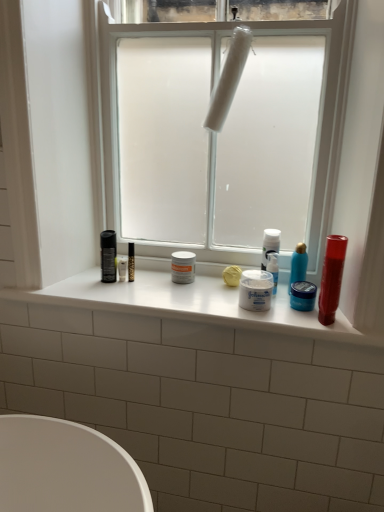
Image resolution: width=384 pixels, height=512 pixels. Describe the element at coordinates (255, 290) in the screenshot. I see `white matte jar at center, which appears as the 2th toiletry when viewed from the left` at that location.

From the picture: How much space does blue glossy bottle at center right, which ranks as the fourth toiletry in left-to-right order, occupy horizontally?

2.44 inches.

How much space does blue glossy bottle at center right, the first toiletry positioned from the right, occupy vertically?

6.68 inches.

What do you see at coordinates (183, 267) in the screenshot?
I see `white matte jar at center, positioned as the first toiletry in left-to-right order` at bounding box center [183, 267].

From the picture: What is the approximate height of blue matte jar at center, which is the third toiletry in left-to-right order?

blue matte jar at center, which is the third toiletry in left-to-right order, is 3.15 inches in height.

Describe the element at coordinates (331, 278) in the screenshot. This screenshot has width=384, height=512. I see `shiny red tube at right` at that location.

This screenshot has width=384, height=512. I want to click on shiny red tube at right, so click(x=331, y=278).

What are the coordinates of `white frosted glass window at center` in the screenshot? It's located at (77, 169).

Is white matte plastic at center in front of white frosted glass window at center?

No.

Is white matte plastic at center wider or thinner than white frosted glass window at center?

Result: In the image, white matte plastic at center appears to be wider than white frosted glass window at center.

From a real-world perspective, is white matte plastic at center located higher than white frosted glass window at center?

Correct, in the physical world, white matte plastic at center is higher than white frosted glass window at center.

From the image's perspective, relative to white frosted glass window at center, is white matte plastic at center above or below?

Based on their image positions, white matte plastic at center is located above white frosted glass window at center.

Between white matte jar at center, placed as the 4th toiletry when sorted from right to left, and blue matte jar at center, the second toiletry when ordered from right to left, which one has smaller width?

blue matte jar at center, the second toiletry when ordered from right to left.

Considering the relative positions of white matte jar at center, placed as the 4th toiletry when sorted from right to left, and blue matte jar at center, which is the third toiletry in left-to-right order, in the image provided, is white matte jar at center, placed as the 4th toiletry when sorted from right to left, in front of blue matte jar at center, which is the third toiletry in left-to-right order,?

No, it is behind blue matte jar at center, which is the third toiletry in left-to-right order.

From a real-world perspective, is white matte jar at center, placed as the 4th toiletry when sorted from right to left, physically below blue matte jar at center, which is the third toiletry in left-to-right order?

No, from a real-world perspective, white matte jar at center, placed as the 4th toiletry when sorted from right to left, is not below blue matte jar at center, which is the third toiletry in left-to-right order.

Considering the points (329, 287) and (279, 310), which point is in front, point (329, 287) or point (279, 310)?

Positioned in front is point (329, 287).

Where is `window sill located below the shiny red tube at right (from the image's perspective)`? window sill located below the shiny red tube at right (from the image's perspective) is located at coordinates (192, 302).

In terms of height, does shiny red tube at right look taller or shorter compared to white glossy window sill at center?

In the image, shiny red tube at right appears to be taller than white glossy window sill at center.

Is shiny red tube at right looking in the opposite direction of white glossy window sill at center?

No.

Who is bigger, white frosted glass window at center or white glossy window sill at center?

Bigger between the two is white frosted glass window at center.

Which is in front, point (380, 144) or point (120, 288)?

Positioned in front is point (380, 144).

From the image's perspective, is white frosted glass window at center under white glossy window sill at center?

Actually, white frosted glass window at center appears above white glossy window sill at center in the image.

From a real-world perspective, who is located lower, white frosted glass window at center or white glossy window sill at center?

In real-world perspective, white glossy window sill at center is lower.

This screenshot has width=384, height=512. In order to click on window screen that is above the white matte jar at center, placed as the 4th toiletry when sorted from right to left (from the image's perspective) in this screenshot , I will do `click(270, 143)`.

Does white matte jar at center, positioned as the first toiletry in left-to-right order, have a lesser height compared to white matte plastic at center?

Correct, white matte jar at center, positioned as the first toiletry in left-to-right order, is not as tall as white matte plastic at center.

Is white matte jar at center, positioned as the first toiletry in left-to-right order, completely or partially outside of white matte plastic at center?

That's correct, white matte jar at center, positioned as the first toiletry in left-to-right order, is outside of white matte plastic at center.

Is white matte jar at center, placed as the 4th toiletry when sorted from right to left, oriented towards white matte plastic at center?

No, white matte jar at center, placed as the 4th toiletry when sorted from right to left, does not turn towards white matte plastic at center.

Considering the relative sizes of white matte jar at center, which appears as the 2th toiletry when viewed from the left, and blue glossy bottle at center right, which ranks as the fourth toiletry in left-to-right order, in the image provided, is white matte jar at center, which appears as the 2th toiletry when viewed from the left, shorter than blue glossy bottle at center right, which ranks as the fourth toiletry in left-to-right order,?

Yes.

Is point (269, 303) closer or farther from the camera than point (304, 248)?

Point (269, 303).

Which is more to the right, white matte jar at center, which appears as the 2th toiletry when viewed from the left, or blue glossy bottle at center right, which ranks as the fourth toiletry in left-to-right order?

From the viewer's perspective, blue glossy bottle at center right, which ranks as the fourth toiletry in left-to-right order, appears more on the right side.

Does white matte jar at center, the third toiletry positioned from the right, have a lesser width compared to blue glossy bottle at center right, which ranks as the fourth toiletry in left-to-right order?

In fact, white matte jar at center, the third toiletry positioned from the right, might be wider than blue glossy bottle at center right, which ranks as the fourth toiletry in left-to-right order.

Who is bigger, white matte plastic at center or shiny red tube at right?

Bigger between the two is white matte plastic at center.

Does point (224, 226) come behind point (326, 279)?

Yes, point (224, 226) is behind point (326, 279).

Which object is positioned more to the left, white matte plastic at center or shiny red tube at right?

white matte plastic at center is more to the left.

Is white matte plastic at center positioned far away from shiny red tube at right?

white matte plastic at center is actually quite close to shiny red tube at right.

Find the location of a particular element. window directly beneath the white matte plastic at center (from a real-world perspective) is located at coordinates (x=77, y=169).

There is a white matte jar at center, placed as the 4th toiletry when sorted from right to left. Identify the location of the 2nd toiletry below it (from the image's perspective). (303, 296).

Considering their positions, is white matte jar at center, the third toiletry positioned from the right, positioned further to blue glossy bottle at center right, the first toiletry positioned from the right, than white matte plastic at center?

Based on the image, white matte plastic at center appears to be further to blue glossy bottle at center right, the first toiletry positioned from the right.

Looking at the image, which one is located further to blue glossy bottle at center right, which ranks as the fourth toiletry in left-to-right order, white matte plastic at center or white frosted glass window at center?

Based on the image, white frosted glass window at center appears to be further to blue glossy bottle at center right, which ranks as the fourth toiletry in left-to-right order.

When comparing their distances from white matte jar at center, which appears as the 2th toiletry when viewed from the left, does white frosted glass window at center or white matte jar at center, positioned as the first toiletry in left-to-right order, seem further?

white frosted glass window at center.

Estimate the real-world distances between objects in this image. Which object is closer to white matte plastic at center, white frosted glass window at center or blue glossy bottle at center right, the first toiletry positioned from the right?

Based on the image, white frosted glass window at center appears to be nearer to white matte plastic at center.

When comparing their distances from white matte plastic at center, does shiny red tube at right or white glossy window sill at center seem closer?

white glossy window sill at center.

When comparing their distances from white matte jar at center, which appears as the 2th toiletry when viewed from the left, does white glossy window sill at center or white frosted glass window at center seem closer?

white glossy window sill at center is closer to white matte jar at center, which appears as the 2th toiletry when viewed from the left.

Considering their positions, is white matte jar at center, the third toiletry positioned from the right, positioned closer to white frosted glass window at center than blue glossy bottle at center right, which ranks as the fourth toiletry in left-to-right order?

white matte jar at center, the third toiletry positioned from the right, is closer to white frosted glass window at center.

Considering their positions, is white glossy window sill at center positioned further to white matte jar at center, positioned as the first toiletry in left-to-right order, than white matte plastic at center?

white matte plastic at center is positioned further to the anchor white matte jar at center, positioned as the first toiletry in left-to-right order.

Find the location of a particular element. The height and width of the screenshot is (512, 384). lip balm between white matte plastic at center and white matte jar at center, which appears as the 2th toiletry when viewed from the left, vertically is located at coordinates (331, 278).

This screenshot has width=384, height=512. Find the location of `lip balm between white matte plastic at center and blue matte jar at center, the second toiletry when ordered from right to left, from top to bottom`. lip balm between white matte plastic at center and blue matte jar at center, the second toiletry when ordered from right to left, from top to bottom is located at coordinates (331, 278).

I want to click on lip balm between white matte plastic at center and white glossy window sill at center in the vertical direction, so click(331, 278).

Identify the location of window between white matte plastic at center and shiny red tube at right from top to bottom. This screenshot has width=384, height=512. [x=77, y=169].